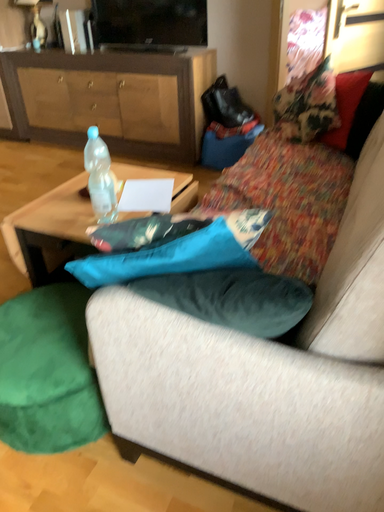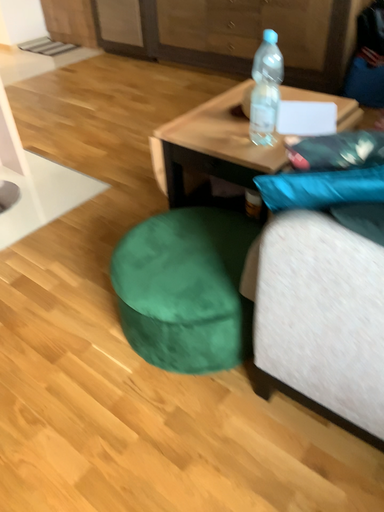
Question: Which way did the camera rotate in the video?

Choices:
 (A) rotated right
 (B) rotated left

Answer: (B)